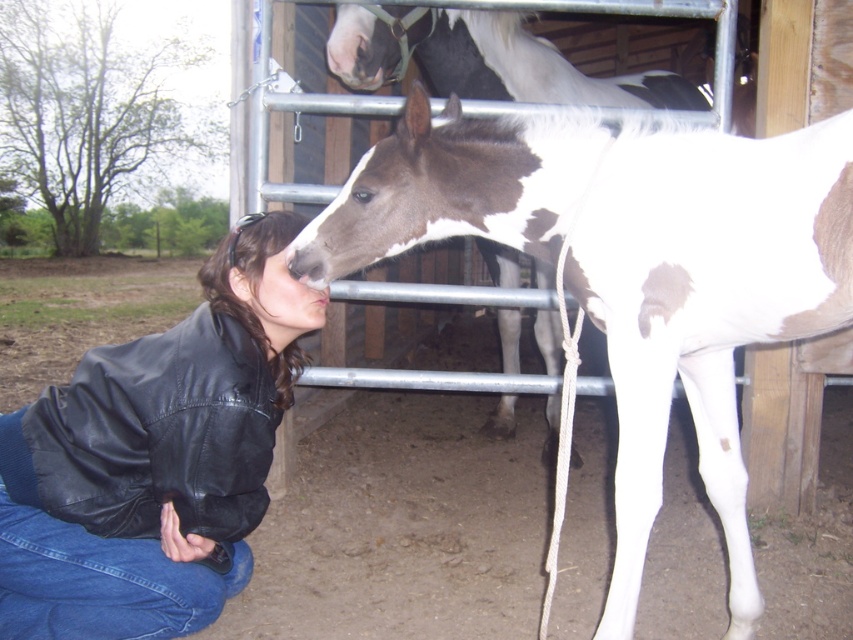
Can you confirm if white glossy horse at center is positioned to the right of black leather jacket at lower left?

Correct, you'll find white glossy horse at center to the right of black leather jacket at lower left.

Does white glossy horse at center have a greater width compared to black leather jacket at lower left?

Yes.

Does point (619, 230) come farther from viewer compared to point (267, 241)?

No, it is not.

Where is `white glossy horse at center`? The height and width of the screenshot is (640, 853). white glossy horse at center is located at coordinates (628, 272).

Who is taller, black leather jacket at lower left or white and brown speckled horse at center?

With more height is black leather jacket at lower left.

Is black leather jacket at lower left in front of white and brown speckled horse at center?

That is True.

The image size is (853, 640). In order to click on black leather jacket at lower left in this screenshot , I will do `click(155, 458)`.

Is white glossy horse at center further to camera compared to white and brown speckled horse at center?

No, white glossy horse at center is closer to the viewer.

Between white glossy horse at center and white and brown speckled horse at center, which one appears on the right side from the viewer's perspective?

From the viewer's perspective, white and brown speckled horse at center appears more on the right side.

The image size is (853, 640). Find the location of `white glossy horse at center`. white glossy horse at center is located at coordinates (628, 272).